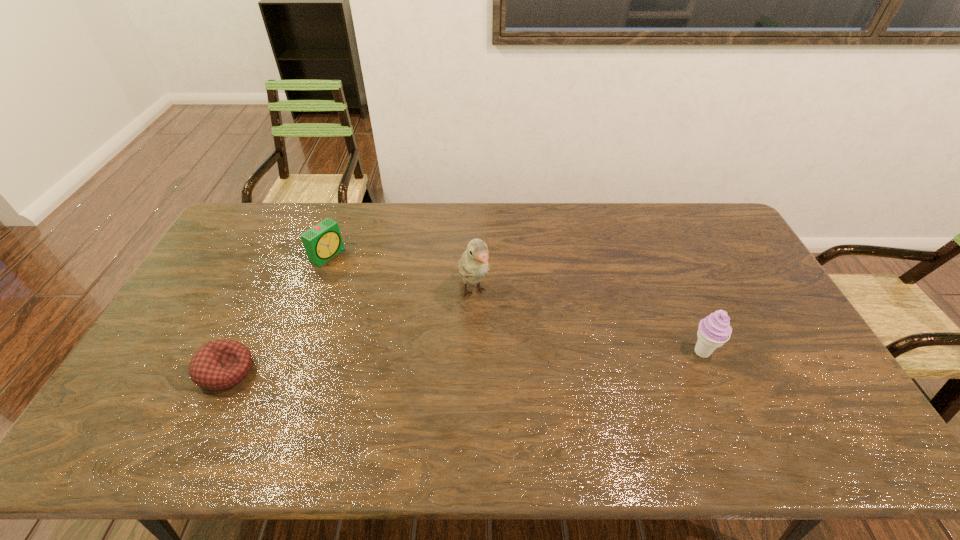
Identify the location of vacant spot on the desktop that is between the leftmost object and the second tallest object and is positioned at the face of the second object from right to left. This screenshot has height=540, width=960. (507, 360).

You are a GUI agent. You are given a task and a screenshot of the screen. Output one action in this format:
    pyautogui.click(x=<x>, y=<y>)
    Task: Click on the vacant space on the desktop that is between the leftmost object and the rightmost object and is positioned on the front-facing side of the third object from right to left
    The height and width of the screenshot is (540, 960).
    Given the screenshot: What is the action you would take?
    pyautogui.click(x=511, y=360)